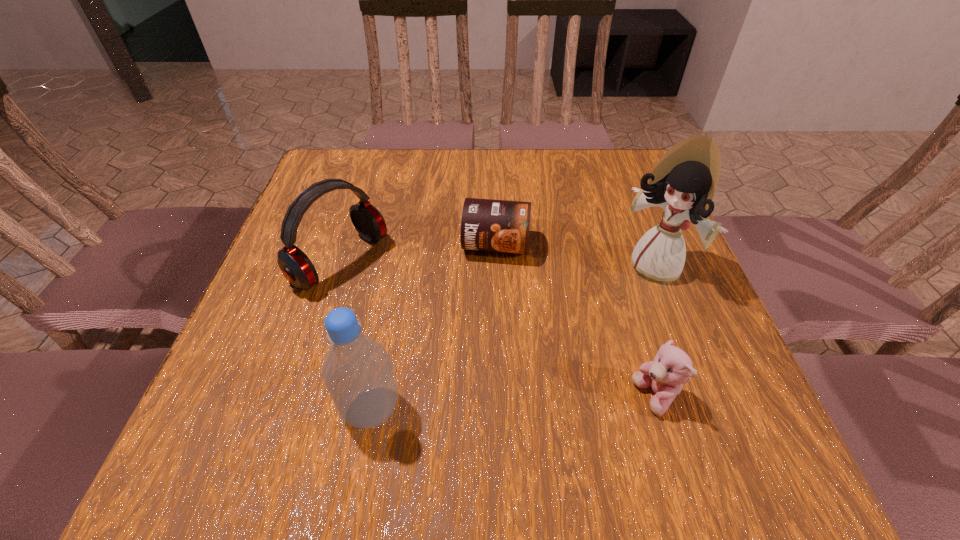
I want to click on blank space located 0.220m on the front label of the can, so click(x=481, y=348).

Image resolution: width=960 pixels, height=540 pixels. I want to click on vacant space positioned 0.220m on the front label of the can, so click(481, 348).

Identify the location of blank space located 0.390m on the ear cups of the third tallest object. (526, 388).

Identify the location of free spot located on the ear cups of the third tallest object. This screenshot has width=960, height=540. (392, 298).

Image resolution: width=960 pixels, height=540 pixels. Find the location of `vacant area situated 0.100m on the ear cups of the third tallest object`. vacant area situated 0.100m on the ear cups of the third tallest object is located at coordinates (405, 307).

I want to click on vacant space positioned at the front face of the tallest object, so click(x=611, y=310).

Identify the location of free spot located at the front face of the tallest object. (606, 316).

I want to click on vacant point located 0.110m at the front face of the tallest object, so click(x=606, y=316).

Where is `bottle that is at the near edge`? The height and width of the screenshot is (540, 960). bottle that is at the near edge is located at coordinates (357, 371).

Image resolution: width=960 pixels, height=540 pixels. I want to click on teddy bear present at the near edge, so click(x=671, y=368).